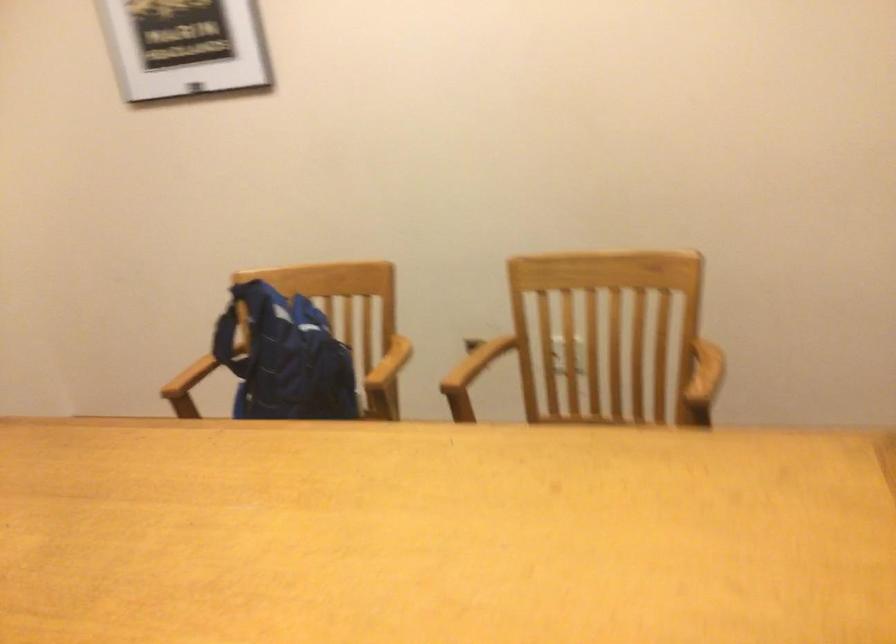
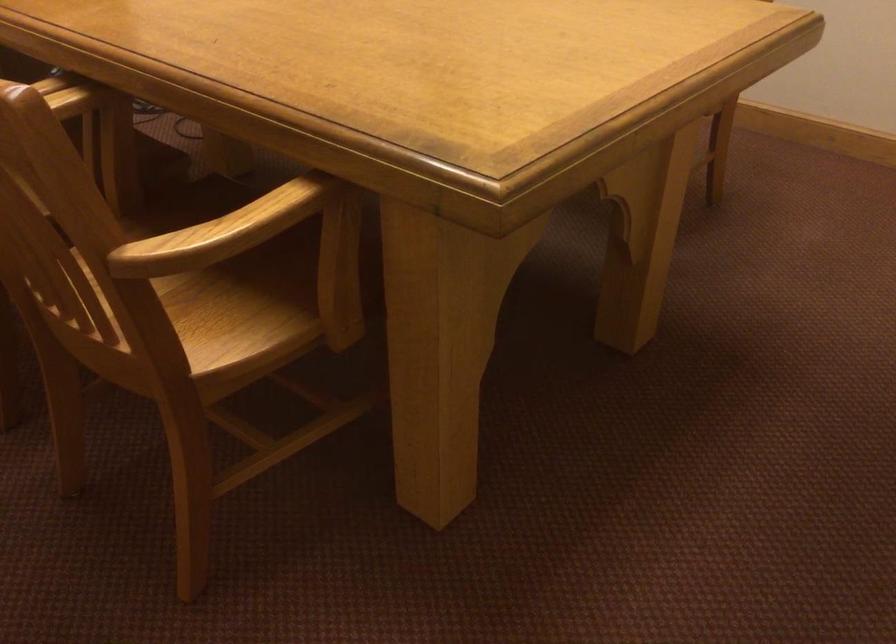
The images are taken continuously from a first-person perspective. In which direction is your viewpoint rotating?

The camera rotated toward left-down.